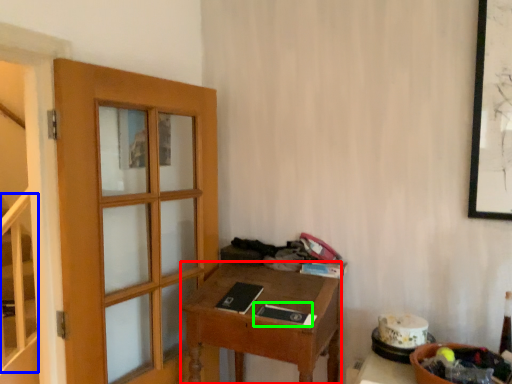
Question: Based on their relative distances, which object is farther from desk (highlighted by a red box)? Choose from stairwell (highlighted by a blue box) and book (highlighted by a green box).

Choices:
 (A) stairwell
 (B) book

Answer: (A)